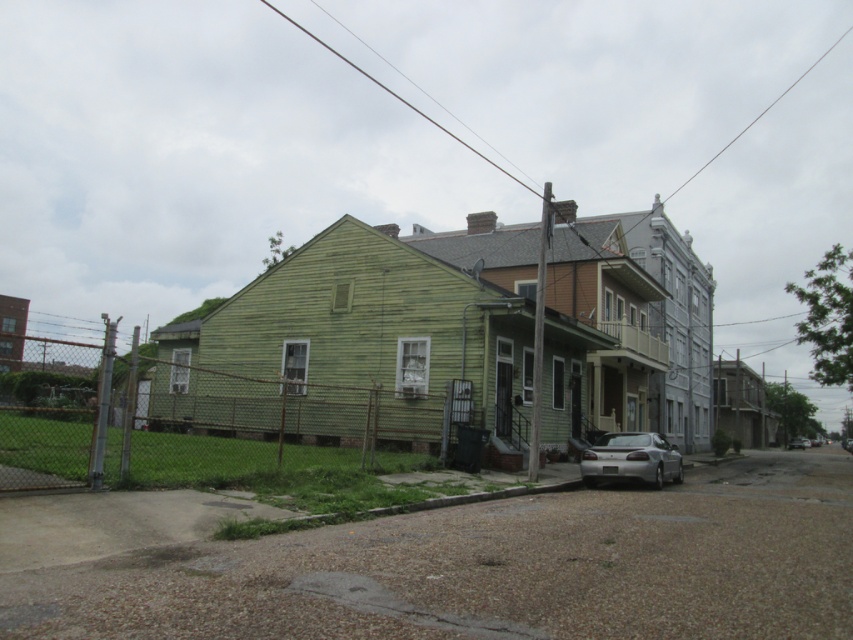
You are a delivery driver who needs to park your truck next to the silver metallic sedan at lower right and the silver metallic sedan at center. Which of the two sedans is shorter in height?

The silver metallic sedan at lower right is not as tall as the silver metallic sedan at center, so the silver metallic sedan at lower right is shorter in height.

You are standing at the center of the residential street scene. You need to park your car in the gravel driveway. Is the silver metallic sedan at lower right blocking your path to the driveway?

The silver metallic sedan at lower right is located at point [631,458], which is near the lower right corner of the scene. Since the driveway is in the foreground leading up to the curb where the sedan is parked, the sedan is likely blocking the path to the driveway.

You are a delivery driver who needs to park your vehicle between the silver metallic sedan at lower right and the silver metallic sedan at center. Given that your vehicle is 1.8 meters wide, can you safely park in that space?

The silver metallic sedan at lower right is thinner than the silver metallic sedan at center, but the description does not provide the exact width of the space between them. Without knowing the width of the space, it is impossible to determine if your vehicle can safely park there.